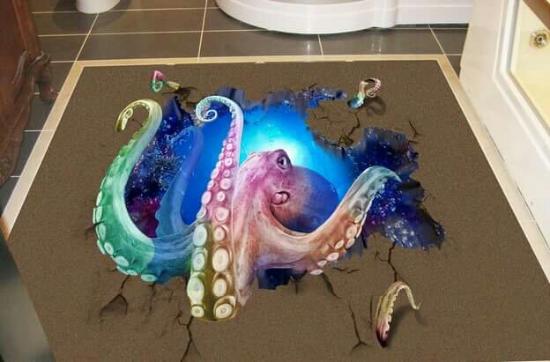
You are a GUI agent. You are given a task and a screenshot of the screen. Output one action in this format:
    pyautogui.click(x=<x>, y=<y>)
    Task: Click on the white trim on wall
    This screenshot has width=550, height=362.
    Given the screenshot: What is the action you would take?
    pyautogui.click(x=535, y=182)